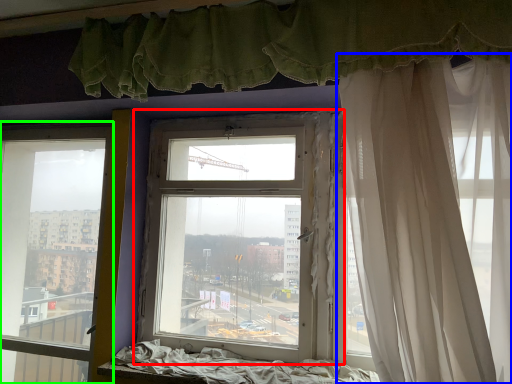
Question: Which object is the farthest from window (highlighted by a red box)? Choose among these: curtain (highlighted by a blue box) or window (highlighted by a green box).

Choices:
 (A) curtain
 (B) window

Answer: (B)